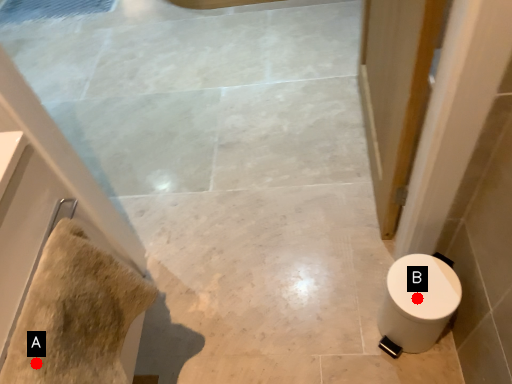
Question: Two points are circled on the image, labeled by A and B beside each circle. Which point is further to the camera?

Choices:
 (A) A is further
 (B) B is further

Answer: (B)